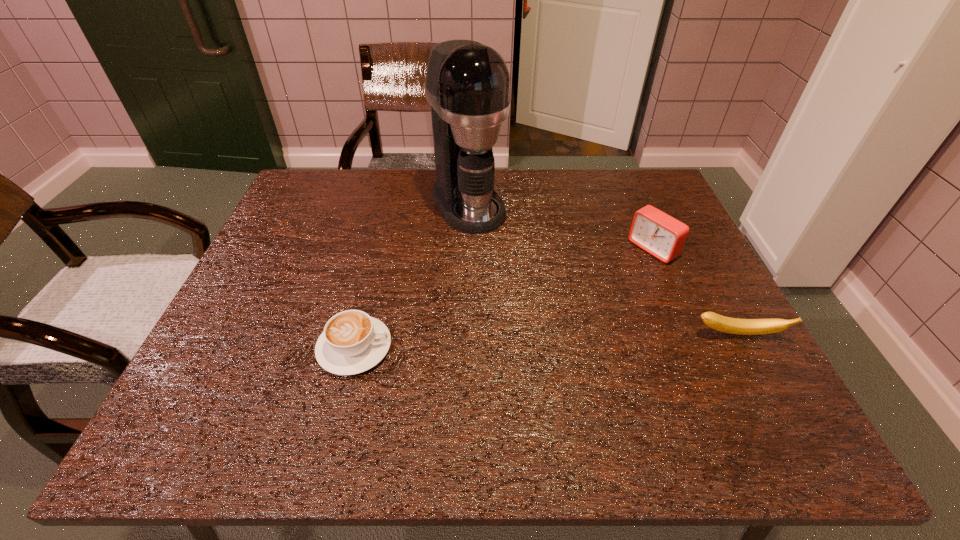
I want to click on cappuccino, so click(x=352, y=342).

Identify the location of banana. (715, 321).

You are a GUI agent. You are given a task and a screenshot of the screen. Output one action in this format:
    pyautogui.click(x=<x>, y=<y>)
    Task: Click on the coffee maker
    The image size is (960, 540).
    Given the screenshot: What is the action you would take?
    pyautogui.click(x=467, y=84)

At what (x,y) coordinates should I click in order to perform the action: click on the second object from left to right. Please return your answer as a coordinate pair (x, y). The image size is (960, 540). Looking at the image, I should click on (467, 84).

Where is `alarm clock`? The image size is (960, 540). alarm clock is located at coordinates (659, 234).

I want to click on vacant space positioned on the side of the leftmost object with the handle, so click(478, 348).

Find the location of `vacant space located at the stem of the banana`. vacant space located at the stem of the banana is located at coordinates (769, 393).

Identify the location of vacant space situated place cup under the spout of the tallest object. This screenshot has height=540, width=960. (552, 334).

Locate an element on the screen. Image resolution: width=960 pixels, height=540 pixels. vacant space located place cup under the spout of the tallest object is located at coordinates click(x=501, y=259).

At what (x,y) coordinates should I click in order to perform the action: click on free spot located place cup under the spout of the tallest object. Please return your answer as a coordinate pair (x, y). The image size is (960, 540). Looking at the image, I should click on (496, 252).